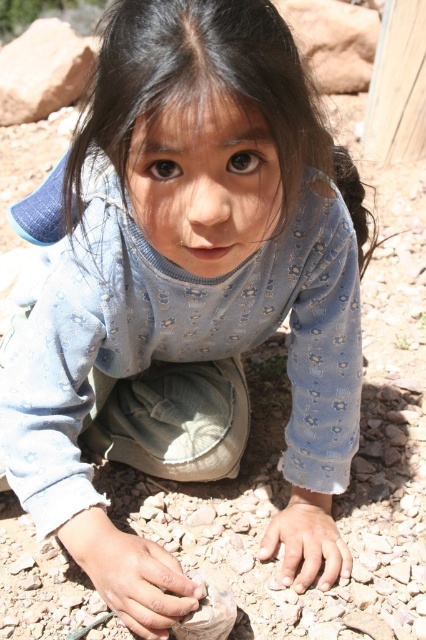
Question: Among these points, which one is nearest to the camera?

Choices:
 (A) (284, 563)
 (B) (284, 77)

Answer: (B)

Question: Observing the image, what is the correct spatial positioning of dirty sand at lower center in reference to smooth stone hand at lower center?

Choices:
 (A) left
 (B) right

Answer: (A)

Question: Which object appears farthest from the camera in this image?

Choices:
 (A) black silky hair at center
 (B) dirty sand at lower center

Answer: (B)

Question: Can you confirm if black silky hair at center is positioned below dirty sand at lower center?

Choices:
 (A) no
 (B) yes

Answer: (A)

Question: Which of the following is the closest to the observer?

Choices:
 (A) smooth stone hand at lower center
 (B) dirty sand at lower center

Answer: (B)

Question: Does dirty sand at lower center have a smaller size compared to smooth stone hand at lower center?

Choices:
 (A) no
 (B) yes

Answer: (A)